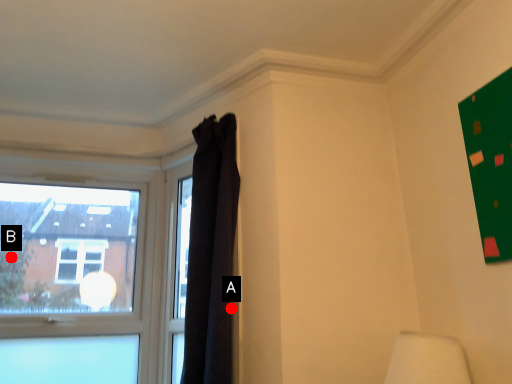
Question: Two points are circled on the image, labeled by A and B beside each circle. Which of the following is the farthest from the observer?

Choices:
 (A) A is further
 (B) B is further

Answer: (B)